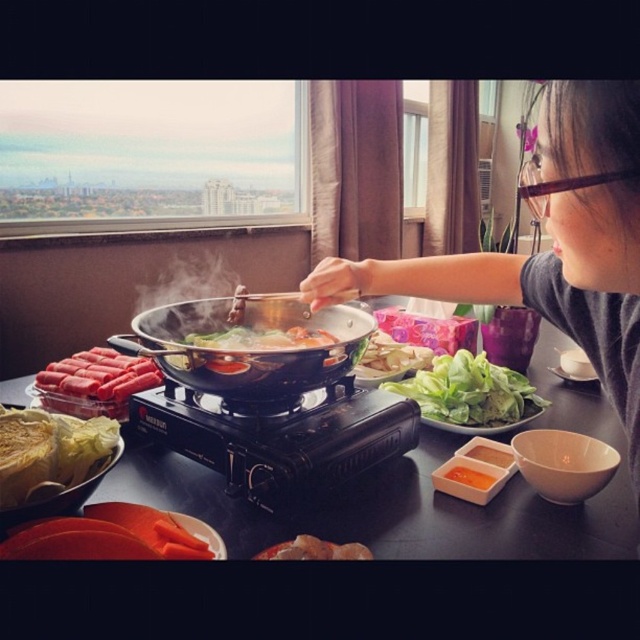
Question: In this image, where is black matte stove at center located relative to translucent plastic container at lower left?

Choices:
 (A) above
 (B) below

Answer: (B)

Question: Estimate the real-world distances between objects in this image. Which object is closer to the brown crispy meat at lower center?

Choices:
 (A) translucent plastic container at lower left
 (B) green leafy lettuce at center
 (C) black matte stove at center
 (D) shiny silver wok at center

Answer: (C)

Question: Can you confirm if black glossy table at center is thinner than matte gray shirt at upper right?

Choices:
 (A) no
 (B) yes

Answer: (A)

Question: Is translucent plastic container at lower left to the right of smokey glass pot at center from the viewer's perspective?

Choices:
 (A) yes
 (B) no

Answer: (B)

Question: Which point is farther to the camera?

Choices:
 (A) black glossy table at center
 (B) green leafy vegetable at lower left
 (C) green leafy lettuce at center

Answer: (C)

Question: Which of the following is the farthest from the observer?

Choices:
 (A) matte gray shirt at upper right
 (B) white smoke at center
 (C) black glossy table at center

Answer: (B)